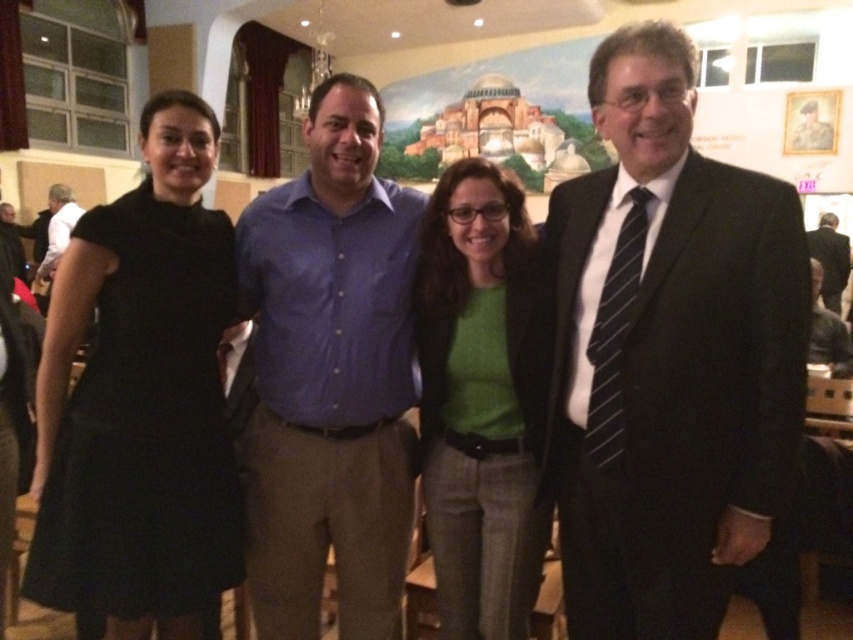
Is point (583, 470) positioned before point (318, 492)?

That is True.

Does point (653, 492) lie in front of point (338, 595)?

That is True.

Where is `matte black suit at right`? The height and width of the screenshot is (640, 853). matte black suit at right is located at coordinates (666, 355).

Who is lower down, matte black suit at right or dark brown leather jacket at lower right?

matte black suit at right is lower down.

Between matte black suit at right and dark brown leather jacket at lower right, which one is positioned higher?

dark brown leather jacket at lower right is above.

Is point (561, 308) closer to camera compared to point (811, 284)?

No, it is not.

Identify the location of matte black suit at right. Image resolution: width=853 pixels, height=640 pixels. pyautogui.click(x=666, y=355).

Describe the element at coordinates (666, 355) in the screenshot. This screenshot has height=640, width=853. I see `matte black suit at right` at that location.

Can you confirm if matte black suit at right is shorter than black dress at left?

Yes, matte black suit at right is shorter than black dress at left.

Image resolution: width=853 pixels, height=640 pixels. Describe the element at coordinates (666, 355) in the screenshot. I see `matte black suit at right` at that location.

Locate an element on the screen. The image size is (853, 640). matte black suit at right is located at coordinates (666, 355).